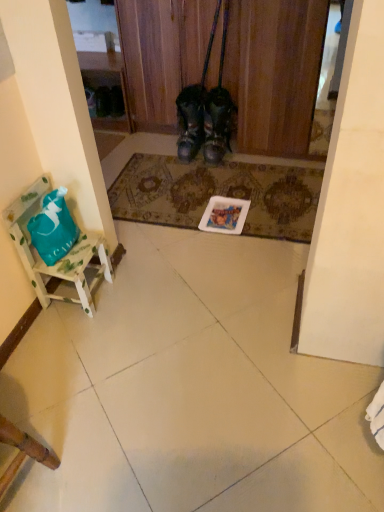
Where is `vacant area that is in front of leather boots at center, which is the second footwear from left to right`? vacant area that is in front of leather boots at center, which is the second footwear from left to right is located at coordinates (220, 170).